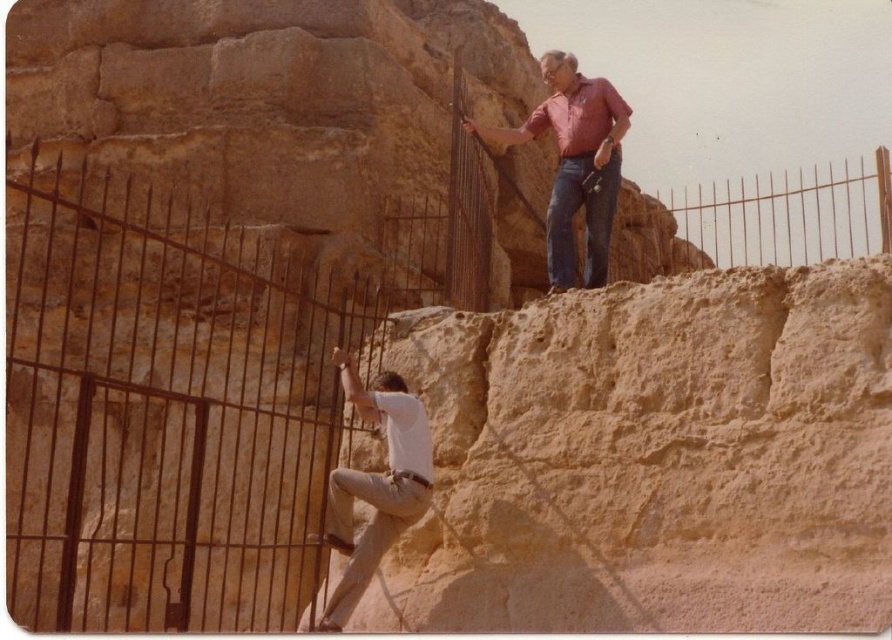
You are a photographer aiming to capture the white cotton shirt at center and blue denim jeans at upper center in a single frame. Based on their positions, which clothing item will appear closer to the bottom of the photo?

The white cotton shirt at center is positioned under the blue denim jeans at upper center, so it will appear closer to the bottom of the photo.

You are standing at the base of the cliff where the man is sitting. You want to walk towards the brown metal fence at upper right. Which direction should you move relative to your current position?

The brown metal fence at upper right is located at coordinate point (789, 212). Since you are at the base of the cliff, you should move towards the upper right direction to reach it.

You are a photographer planning to capture a wide shot of the archaeological site. You want to ensure both the rusty metal fence at left and the blue denim jeans at upper center are visible in the frame. Considering their sizes, which object will occupy more space in the photo?

The rusty metal fence at left is bigger than the blue denim jeans at upper center, so it will occupy more space in the photo.